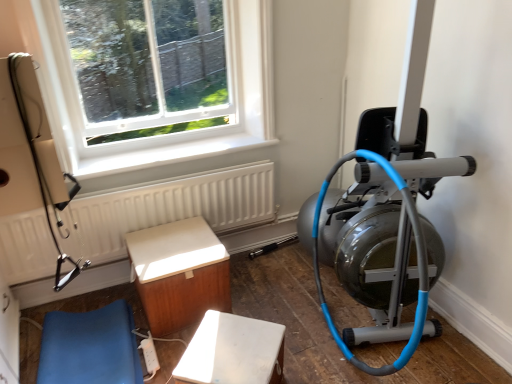
Question: Can you confirm if blue leather cushion at lower left, the 3th furniture when ordered from right to left, is smaller than white plastic window at upper left?

Choices:
 (A) no
 (B) yes

Answer: (B)

Question: Are blue leather cushion at lower left, the first furniture when ordered from left to right, and white plastic window at upper left making contact?

Choices:
 (A) no
 (B) yes

Answer: (A)

Question: Can you confirm if blue leather cushion at lower left, the first furniture when ordered from left to right, is positioned to the right of white plastic window at upper left?

Choices:
 (A) no
 (B) yes

Answer: (A)

Question: Is white plastic window at upper left inside blue leather cushion at lower left, the first furniture when ordered from left to right?

Choices:
 (A) yes
 (B) no

Answer: (B)

Question: Considering the relative sizes of blue leather cushion at lower left, the first furniture when ordered from left to right, and white plastic window at upper left in the image provided, is blue leather cushion at lower left, the first furniture when ordered from left to right, bigger than white plastic window at upper left?

Choices:
 (A) yes
 (B) no

Answer: (B)

Question: From the image's perspective, is white textured radiator at upper left above or below silver metallic stationary bicycle at right?

Choices:
 (A) below
 (B) above

Answer: (B)

Question: Which is correct: white textured radiator at upper left is inside silver metallic stationary bicycle at right, or outside of it?

Choices:
 (A) inside
 (B) outside

Answer: (B)

Question: From a real-world perspective, is white textured radiator at upper left positioned above or below silver metallic stationary bicycle at right?

Choices:
 (A) above
 (B) below

Answer: (B)

Question: Considering the positions of white textured radiator at upper left and silver metallic stationary bicycle at right in the image, is white textured radiator at upper left bigger or smaller than silver metallic stationary bicycle at right?

Choices:
 (A) big
 (B) small

Answer: (B)

Question: Considering the positions of blue leather cushion at lower left, the 3th furniture when ordered from right to left, and white plastic extension cord at lower center in the image, is blue leather cushion at lower left, the 3th furniture when ordered from right to left, wider or thinner than white plastic extension cord at lower center?

Choices:
 (A) wide
 (B) thin

Answer: (A)

Question: Is blue leather cushion at lower left, the 3th furniture when ordered from right to left, spatially inside white plastic extension cord at lower center, or outside of it?

Choices:
 (A) inside
 (B) outside

Answer: (B)

Question: Relative to white plastic extension cord at lower center, is blue leather cushion at lower left, the 3th furniture when ordered from right to left, in front or behind?

Choices:
 (A) behind
 (B) front

Answer: (B)

Question: Considering the positions of blue leather cushion at lower left, the first furniture when ordered from left to right, and white plastic extension cord at lower center in the image, is blue leather cushion at lower left, the first furniture when ordered from left to right, taller or shorter than white plastic extension cord at lower center?

Choices:
 (A) tall
 (B) short

Answer: (A)

Question: From a real-world perspective, is white matte bench at lower center, marked as the 3th furniture in a left-to-right arrangement, above or below white plastic extension cord at lower center?

Choices:
 (A) below
 (B) above

Answer: (B)

Question: Is white matte bench at lower center, the first furniture from the right, spatially inside white plastic extension cord at lower center, or outside of it?

Choices:
 (A) inside
 (B) outside

Answer: (B)